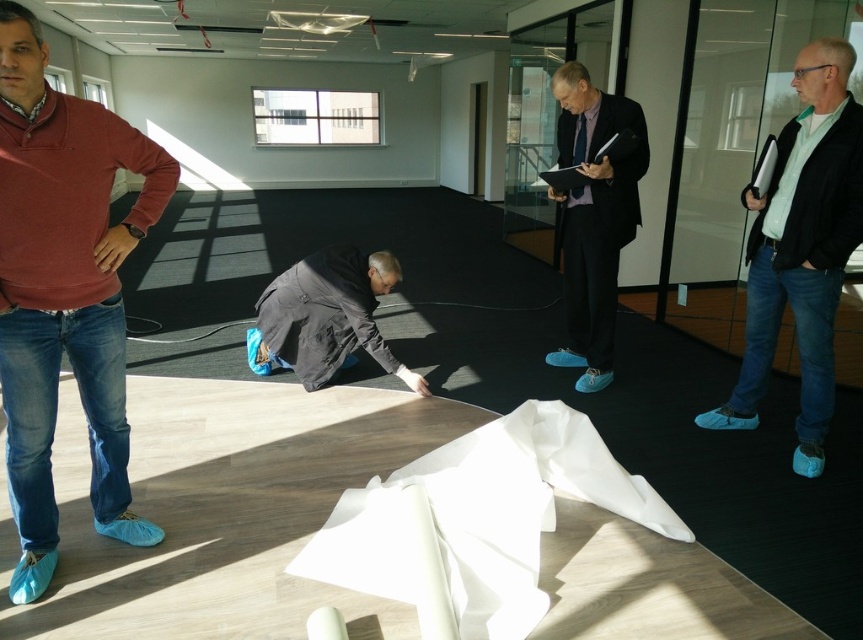
Between matte red sweater at left and dark blue suit at center, which one is positioned higher?

dark blue suit at center is higher up.

The height and width of the screenshot is (640, 863). Identify the location of matte red sweater at left. (64, 291).

Does point (41, 538) lie behind point (589, 227)?

That is False.

I want to click on matte red sweater at left, so click(x=64, y=291).

Which is more to the left, matte red sweater at left or black matte jacket at center?

From the viewer's perspective, matte red sweater at left appears more on the left side.

Identify the location of matte red sweater at left. 64,291.

Who is more distant from viewer, (1, 0) or (288, 284)?

Point (288, 284)

At what (x,y) coordinates should I click in order to perform the action: click on matte red sweater at left. Please return your answer as a coordinate pair (x, y). Looking at the image, I should click on (64, 291).

Where is `dark blue suit at center`? This screenshot has width=863, height=640. dark blue suit at center is located at coordinates (593, 218).

Image resolution: width=863 pixels, height=640 pixels. What do you see at coordinates (593, 218) in the screenshot? I see `dark blue suit at center` at bounding box center [593, 218].

This screenshot has width=863, height=640. I want to click on dark blue suit at center, so click(x=593, y=218).